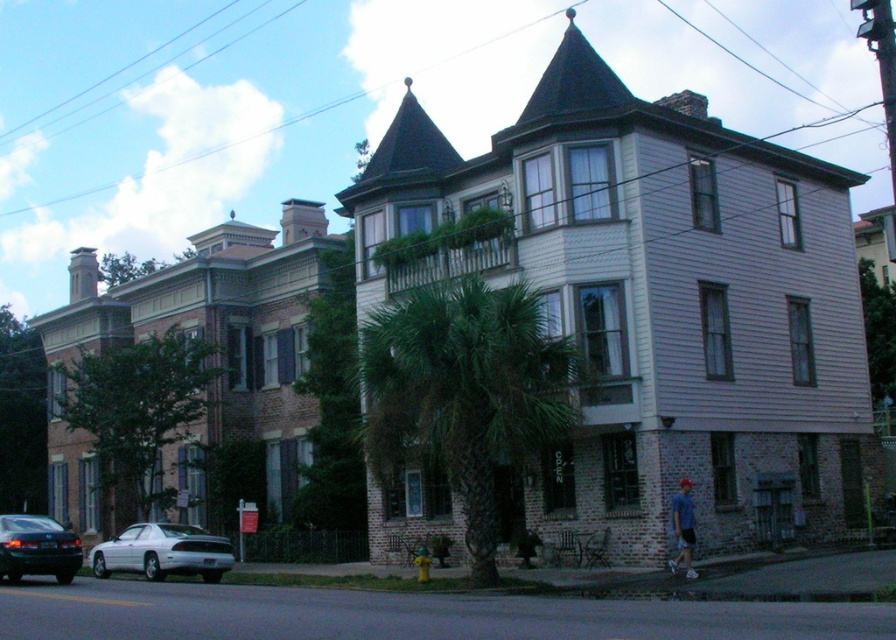
Is white glossy car at lower left wider than blue cotton shirt at lower right?

Yes.

Who is shorter, white glossy car at lower left or blue cotton shirt at lower right?

white glossy car at lower left

Between point (188, 560) and point (686, 508), which one is positioned in front?

Positioned in front is point (686, 508).

What are the coordinates of `white glossy car at lower left` in the screenshot? It's located at (162, 552).

Is green leafy palm tree at center taller than shiny black sedan at lower left?

In fact, green leafy palm tree at center may be shorter than shiny black sedan at lower left.

Which is more to the left, green leafy palm tree at center or shiny black sedan at lower left?

shiny black sedan at lower left is more to the left.

Locate an element on the screen. The width and height of the screenshot is (896, 640). green leafy palm tree at center is located at coordinates (464, 394).

Does white glossy car at lower left appear on the right side of shiny black sedan at lower left?

Yes, white glossy car at lower left is to the right of shiny black sedan at lower left.

Based on the photo, can you confirm if white glossy car at lower left is bigger than shiny black sedan at lower left?

Indeed, white glossy car at lower left has a larger size compared to shiny black sedan at lower left.

Image resolution: width=896 pixels, height=640 pixels. In order to click on white glossy car at lower left in this screenshot , I will do `click(162, 552)`.

At what (x,y) coordinates should I click in order to perform the action: click on white glossy car at lower left. Please return your answer as a coordinate pair (x, y). Looking at the image, I should click on (162, 552).